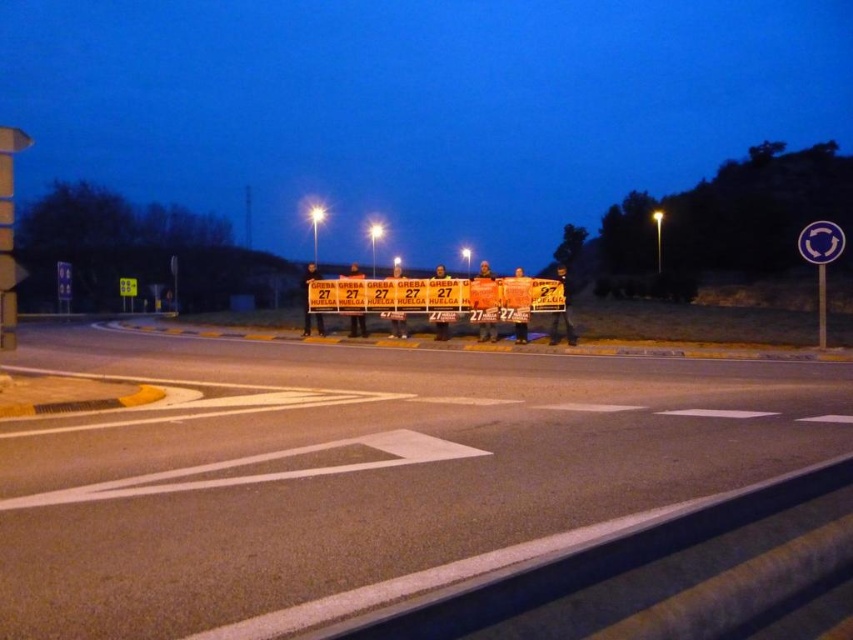
Question: Is metallic reflective circle at upper right to the left of yellow reflective square at upper left from the viewer's perspective?

Choices:
 (A) yes
 (B) no

Answer: (B)

Question: Which object appears farthest from the camera in this image?

Choices:
 (A) metallic reflective circle at upper right
 (B) yellow reflective square at upper left

Answer: (B)

Question: Does metallic reflective circle at upper right have a larger size compared to yellow reflective square at upper left?

Choices:
 (A) yes
 (B) no

Answer: (B)

Question: Considering the relative positions of metallic reflective circle at upper right and yellow reflective square at upper left in the image provided, where is metallic reflective circle at upper right located with respect to yellow reflective square at upper left?

Choices:
 (A) right
 (B) left

Answer: (A)